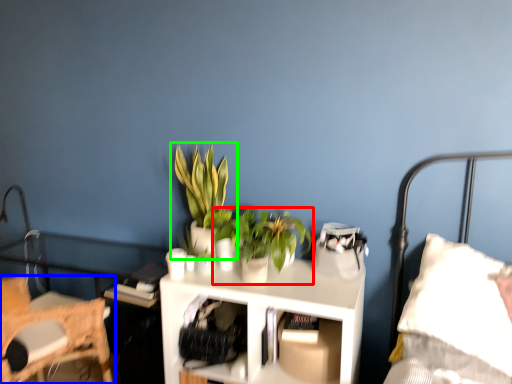
Question: Based on their relative distances, which object is farther from houseplant (highlighted by a red box)? Choose from chair (highlighted by a blue box) and houseplant (highlighted by a green box).

Choices:
 (A) chair
 (B) houseplant

Answer: (A)